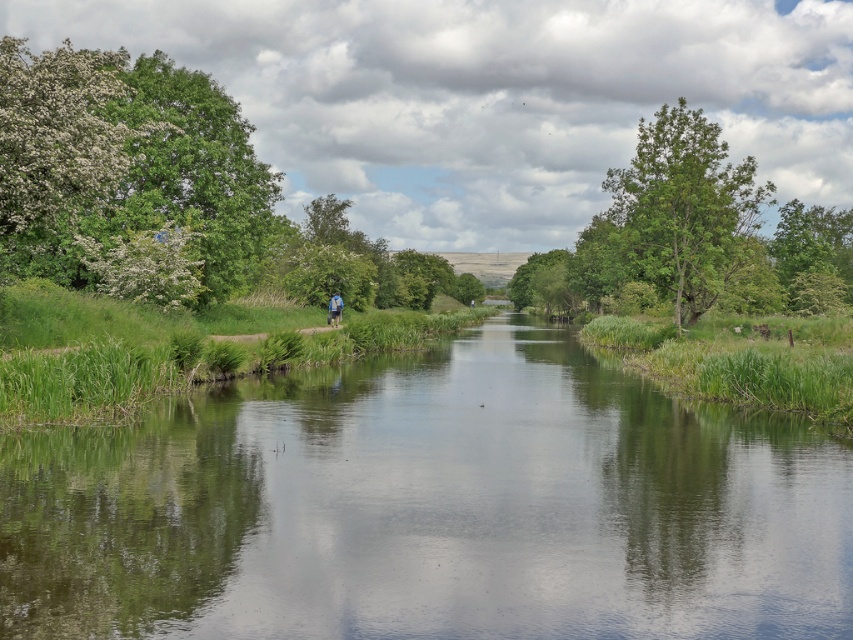
You are planning to cross the river using a small wooden bridge that can only support a width of 2 meters. Based on the scene, will the green grassy stream at center and the green leafy tree at right allow you to safely cross?

The green grassy stream at center has a lesser width compared to green leafy tree at right. Since the stream is narrower than the tree, and the bridge can support 2 meters, the stream is likely narrow enough for safe crossing. However, the tree might be wider than the bridge, so avoid it.

You are standing at the edge of the green grassy stream at center and want to place your blue fabric backpack at center on the ground. Can you put it directly in front of the stream without it being hidden from view?

The green grassy stream at center is closer to the viewer than the blue fabric backpack at center. Therefore, placing the blue fabric backpack at center directly in front of the stream would position it behind the stream, making it hidden from view. Choose another spot behind the backpack instead.

Consider the image. You are standing at the edge of the green grassy stream at center and want to reach the blue fabric backpack at center. The backpack is on the other side of the stream. Can you cross the stream to get to the backpack?

The green grassy stream at center and blue fabric backpack at center are 24.77 meters apart. Since the backpack is on the other side of the stream, you would need to cross the stream to reach it. However, the distance between them is quite large, so it might be challenging to cross directly without a bridge or a safe path.